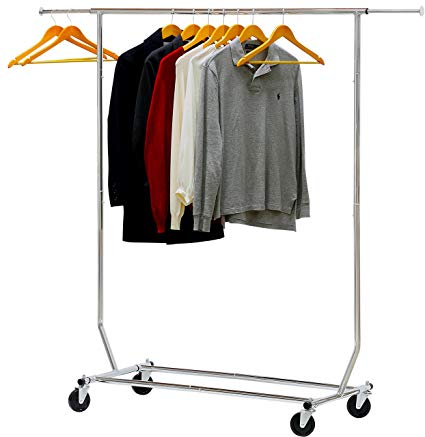
Locate an element on the screen. The height and width of the screenshot is (437, 425). wooden clothes hanger is located at coordinates (52, 29), (69, 30), (172, 29), (191, 29), (204, 29), (218, 30), (232, 30), (251, 30), (280, 30).